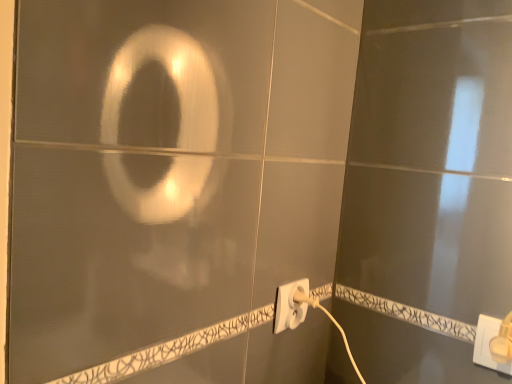
Question: From the image's perspective, relative to white plastic power plug at lower center, the first power plugs and sockets in the left-to-right sequence, is white plastic power plug at lower right, the first power plugs and sockets positioned from the front, above or below?

Choices:
 (A) above
 (B) below

Answer: (B)

Question: Based on their sizes in the image, would you say white plastic power plug at lower right, positioned as the second power plugs and sockets in back-to-front order, is bigger or smaller than white plastic power plug at lower center, positioned as the second power plugs and sockets in right-to-left order?

Choices:
 (A) small
 (B) big

Answer: (A)

Question: Is point (492, 331) positioned closer to the camera than point (289, 299)?

Choices:
 (A) closer
 (B) farther

Answer: (A)

Question: In the image, is white plastic power plug at lower center, which is the first power plugs and sockets from back to front, on the left side or the right side of white plastic power plug at lower right, the first power plugs and sockets positioned from the front?

Choices:
 (A) left
 (B) right

Answer: (A)

Question: From their relative heights in the image, would you say white plastic power plug at lower center, the first power plugs and sockets in the left-to-right sequence, is taller or shorter than white plastic power plug at lower right, the second power plugs and sockets positioned from the left?

Choices:
 (A) short
 (B) tall

Answer: (B)

Question: From the image's perspective, relative to white plastic power plug at lower right, acting as the first power plugs and sockets starting from the right, is white plastic power plug at lower center, arranged as the second power plugs and sockets when viewed from the front, above or below?

Choices:
 (A) above
 (B) below

Answer: (A)

Question: Considering the positions of point (280, 302) and point (486, 357), is point (280, 302) closer or farther from the camera than point (486, 357)?

Choices:
 (A) farther
 (B) closer

Answer: (A)